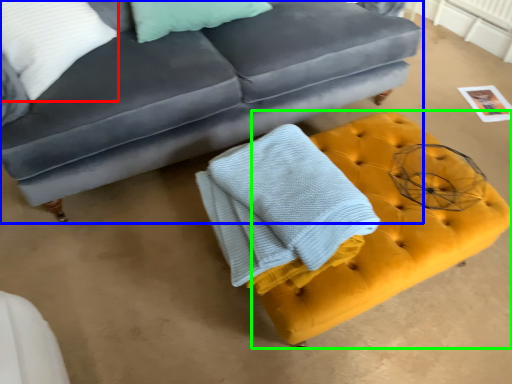
Question: Which is nearer to the pillow (highlighted by a red box)? studio couch (highlighted by a blue box) or footrest (highlighted by a green box).

Choices:
 (A) studio couch
 (B) footrest

Answer: (A)